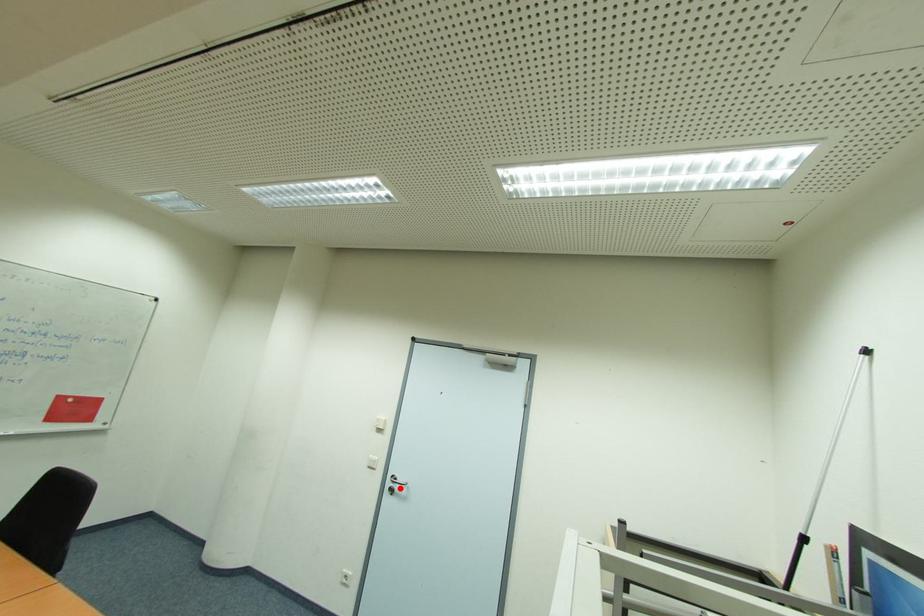
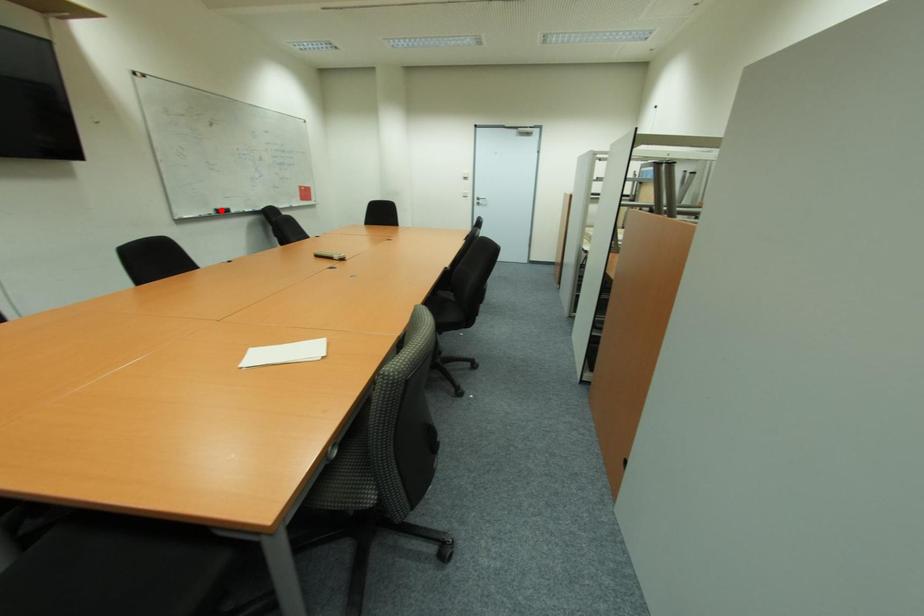
I am providing you with two images of the same scene from different viewpoints. A red point is marked on the first image and another point is marked on the second image. Is the marked point in image1 the same physical position as the marked point in image2?

No